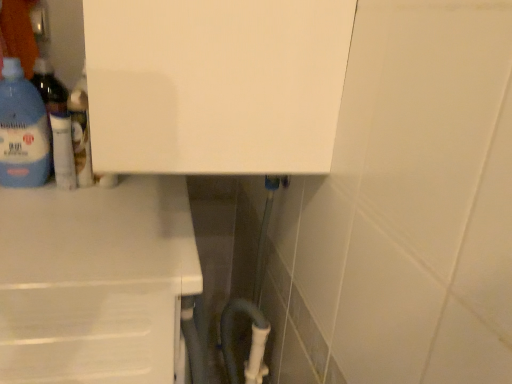
Question: Is translucent plastic bottle at left, the 2th bottle positioned from the right, positioned with its back to white glossy lotion at upper left, the 2th bottle when ordered from left to right?

Choices:
 (A) yes
 (B) no

Answer: (B)

Question: From the image's perspective, is translucent plastic bottle at left, which appears as the 1th bottle when viewed from the left, above white glossy lotion at upper left, marked as the 1th bottle in a right-to-left arrangement?

Choices:
 (A) no
 (B) yes

Answer: (B)

Question: Are translucent plastic bottle at left, the 2th bottle positioned from the right, and white glossy lotion at upper left, the 2th bottle when ordered from left to right, far apart?

Choices:
 (A) yes
 (B) no

Answer: (B)

Question: Does translucent plastic bottle at left, the 2th bottle positioned from the right, come behind white glossy lotion at upper left, the 2th bottle when ordered from left to right?

Choices:
 (A) yes
 (B) no

Answer: (B)

Question: Is translucent plastic bottle at left, which appears as the 1th bottle when viewed from the left, with white glossy lotion at upper left, the 2th bottle when ordered from left to right?

Choices:
 (A) yes
 (B) no

Answer: (B)

Question: Does translucent plastic bottle at left, which appears as the 1th bottle when viewed from the left, appear on the left side of white glossy lotion at upper left, the 2th bottle when ordered from left to right?

Choices:
 (A) yes
 (B) no

Answer: (A)

Question: Does white matte counter at lower left have a lesser width compared to white glossy lotion at upper left, marked as the 1th bottle in a right-to-left arrangement?

Choices:
 (A) yes
 (B) no

Answer: (B)

Question: From the image's perspective, would you say white matte counter at lower left is positioned over white glossy lotion at upper left, the 2th bottle when ordered from left to right?

Choices:
 (A) no
 (B) yes

Answer: (A)

Question: Is white matte counter at lower left far away from white glossy lotion at upper left, marked as the 1th bottle in a right-to-left arrangement?

Choices:
 (A) yes
 (B) no

Answer: (B)

Question: Would you say white matte counter at lower left is outside white glossy lotion at upper left, the 2th bottle when ordered from left to right?

Choices:
 (A) no
 (B) yes

Answer: (B)

Question: Is white matte counter at lower left behind white glossy lotion at upper left, marked as the 1th bottle in a right-to-left arrangement?

Choices:
 (A) no
 (B) yes

Answer: (A)

Question: Does white matte counter at lower left have a greater height compared to white glossy lotion at upper left, the 2th bottle when ordered from left to right?

Choices:
 (A) yes
 (B) no

Answer: (A)

Question: Can you confirm if white glossy lotion at upper left, marked as the 1th bottle in a right-to-left arrangement, is bigger than white matte counter at lower left?

Choices:
 (A) no
 (B) yes

Answer: (A)